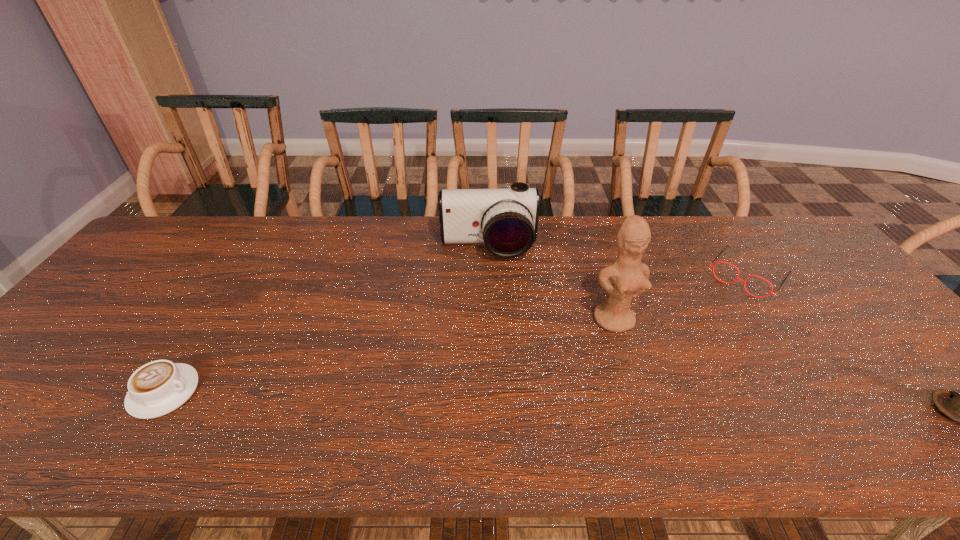
Find the location of a particular element. This screenshot has height=540, width=960. free space on the desktop that is between the cappuccino and the candle holder and is positioned on the front-facing side of the tallest object is located at coordinates (659, 403).

Locate an element on the screen. The width and height of the screenshot is (960, 540). vacant space on the desktop that is between the cappuccino and the third tallest object and is positioned on the surface of the fourth object from right to left is located at coordinates (499, 400).

Image resolution: width=960 pixels, height=540 pixels. I want to click on free spot on the desktop that is between the cappuccino and the rightmost object and is positioned on the front-facing side of the spectacles, so click(648, 403).